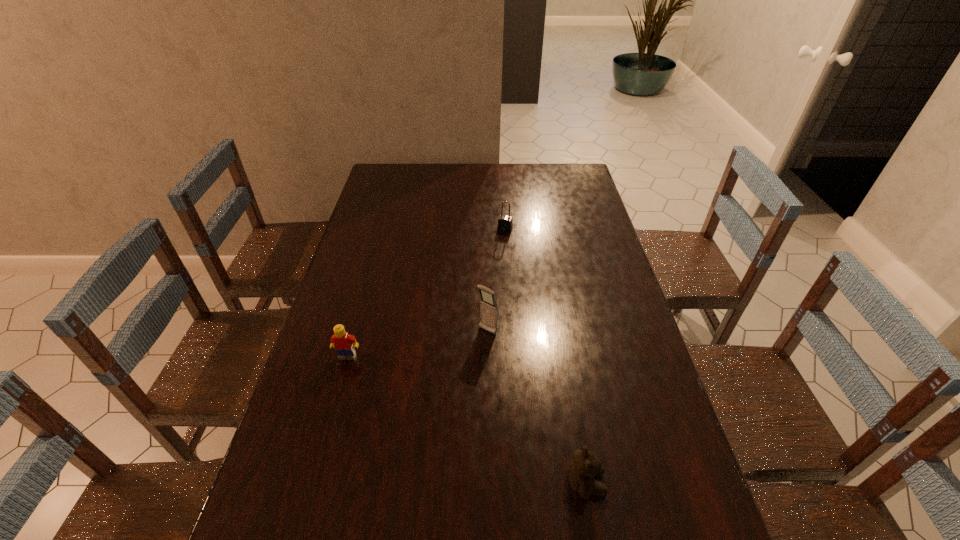
Locate an element on the screen. free space that satisfies the following two spatial constraints: 1. on the front-facing side of the leftmost object; 2. on the face of the teddy bear is located at coordinates (312, 483).

What are the coordinates of `free space that satisfies the following two spatial constraints: 1. on the front side of the nearest object; 2. on the face of the second object from left to right` in the screenshot? It's located at (490, 483).

Where is `vacant space that satisfies the following two spatial constraints: 1. on the front-facing side of the second nearest object; 2. on the face of the nearest object`? vacant space that satisfies the following two spatial constraints: 1. on the front-facing side of the second nearest object; 2. on the face of the nearest object is located at coordinates (312, 483).